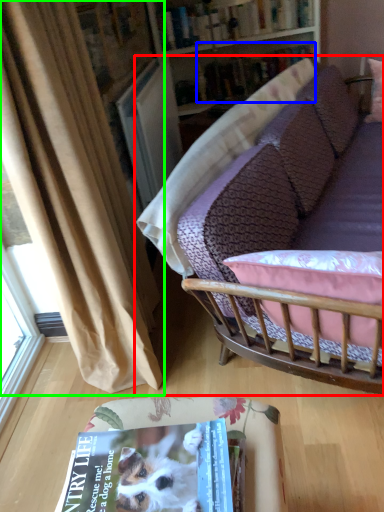
Question: Considering the real-world distances, which object is closest to studio couch (highlighted by a red box)? book (highlighted by a blue box) or curtain (highlighted by a green box).

Choices:
 (A) book
 (B) curtain

Answer: (B)